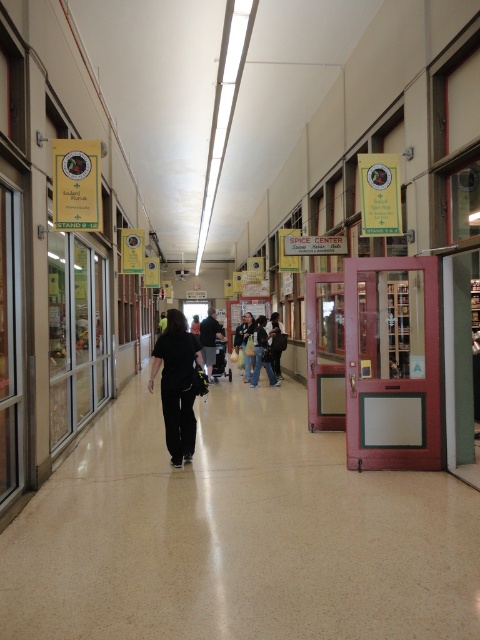
You are a delivery person carrying a large box that is 1.2 meters wide. You are standing in the middle of the brown speckled tile floor at center and need to pass through the corridor. Can your box fit through the space between the black matte pants at center and the nearest wall?

The brown speckled tile floor at center might be wider than black matte pants at center, so the corridor might have enough width to accommodate the 1.2 meter wide box. However, since the exact width isn

You are a delivery person standing at the entrance of the market corridor. You need to place a package on the brown speckled tile floor at center. However, there are black matte pants at center in your way. Can you estimate if there is enough space to place the package without moving the pants?

The brown speckled tile floor at center and black matte pants at center are 6.28 feet apart from each other. Since the distance between them is more than enough to place a package, you can safely do so without moving the pants.

You are navigating through the indoor market and need to reach a specific point. You are currently at point (179, 333). Which direction should you move to get to point (121, 605)?

Point (121, 605) is in front of point (179, 333), so you should move forward to reach it.